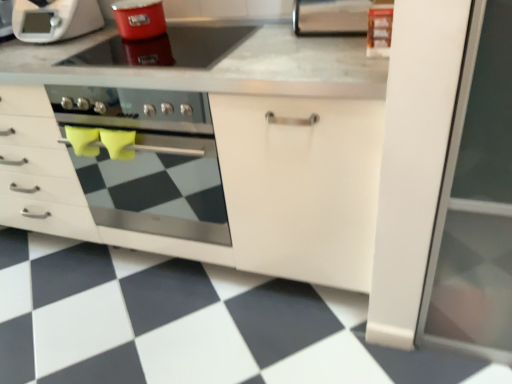
Question: Considering their positions, is shiny red pot at upper center located in front of or behind metallic stainless steel paper towel holder at upper center?

Choices:
 (A) behind
 (B) front

Answer: (B)

Question: From a real-world perspective, is shiny red pot at upper center physically located above or below metallic stainless steel paper towel holder at upper center?

Choices:
 (A) above
 (B) below

Answer: (B)

Question: Considering the real-world distances, which object is closest to the metallic stainless steel paper towel holder at upper center?

Choices:
 (A) white matte cabinet at center
 (B) shiny red pot at upper center
 (C) white matte microwave at upper left
 (D) stainless steel oven at center
 (E) matte red pot at upper center

Answer: (B)

Question: Which object is the closest to the shiny red pot at upper center?

Choices:
 (A) matte red pot at upper center
 (B) metallic stainless steel paper towel holder at upper center
 (C) white matte microwave at upper left
 (D) stainless steel oven at center
 (E) white matte cabinet at center

Answer: (A)